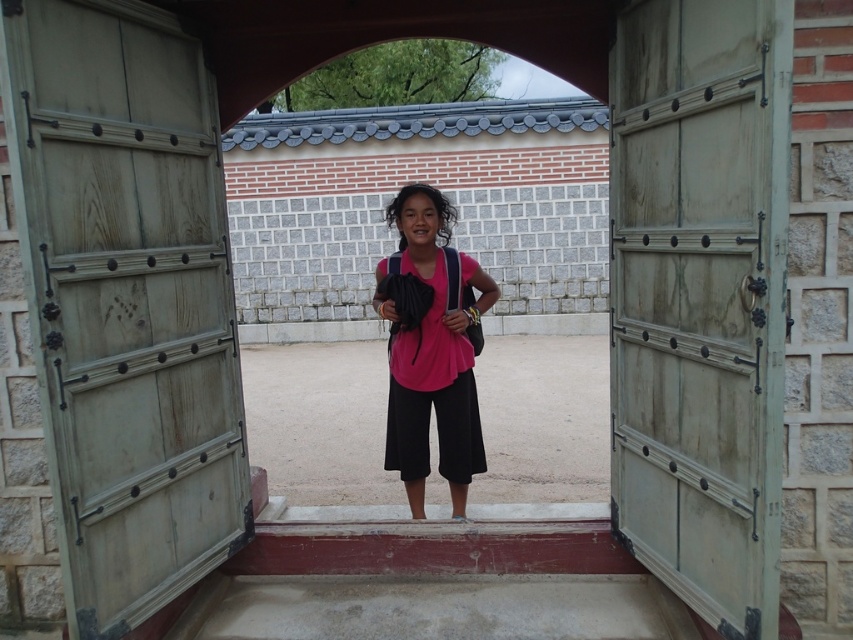
Is greenish-gray wood door at center above pink fabric shirt at center?

Yes, greenish-gray wood door at center is above pink fabric shirt at center.

Is greenish-gray wood door at center positioned behind pink fabric shirt at center?

No, greenish-gray wood door at center is in front of pink fabric shirt at center.

Is point (642, 310) behind point (415, 323)?

No, (642, 310) is closer to viewer.

Locate an element on the screen. This screenshot has width=853, height=640. greenish-gray wood door at center is located at coordinates (699, 298).

Find the location of a particular element. The width and height of the screenshot is (853, 640). green wood door at center is located at coordinates (126, 300).

Who is positioned more to the right, green wood door at center or pink fabric shirt at center?

From the viewer's perspective, pink fabric shirt at center appears more on the right side.

The image size is (853, 640). Identify the location of green wood door at center. (126, 300).

Locate an element on the screen. green wood door at center is located at coordinates (126, 300).

Is green wood door at center positioned in front of greenish-gray wood door at center?

No, green wood door at center is behind greenish-gray wood door at center.

Find the location of a particular element. green wood door at center is located at coordinates (126, 300).